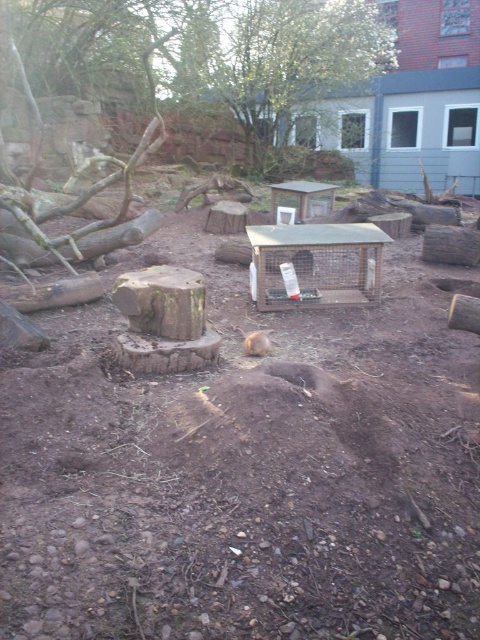
Question: Is brown soil at center above brown furry animal at center?

Choices:
 (A) yes
 (B) no

Answer: (B)

Question: Among these points, which one is farthest from the camera?

Choices:
 (A) (252, 339)
 (B) (101, 627)

Answer: (A)

Question: Among these points, which one is farthest from the camera?

Choices:
 (A) (251, 337)
 (B) (225, 529)

Answer: (A)

Question: From the image, what is the correct spatial relationship of brown soil at center in relation to brown furry animal at center?

Choices:
 (A) right
 (B) left

Answer: (B)

Question: Is brown soil at center closer to the viewer compared to brown furry animal at center?

Choices:
 (A) no
 (B) yes

Answer: (B)

Question: Among these objects, which one is farthest from the camera?

Choices:
 (A) brown soil at center
 (B) brown furry animal at center

Answer: (B)